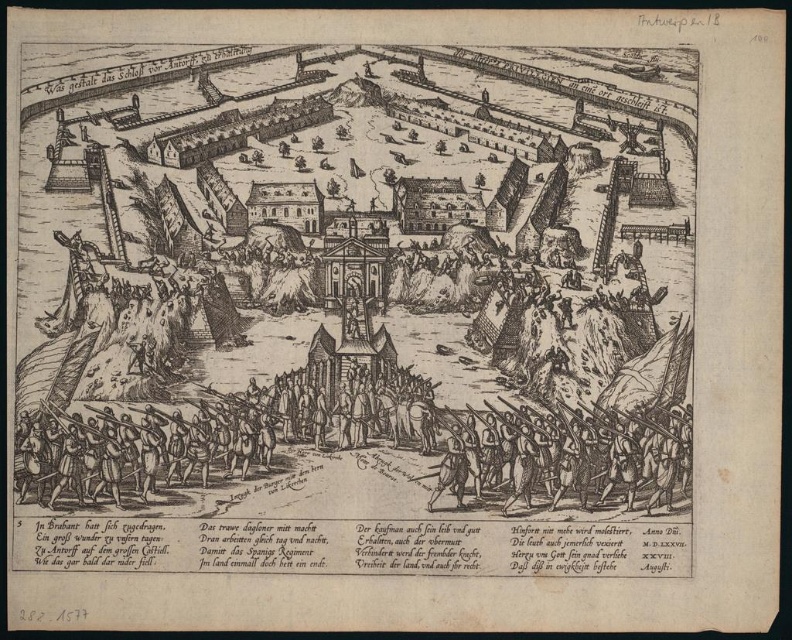
Question: Which point is closer to the camera?

Choices:
 (A) (168, 449)
 (B) (535, 476)
 (C) (309, 376)

Answer: (B)

Question: Which object is positioned farthest from the wooden spears at center?

Choices:
 (A) wooden spears at lower center
 (B) wooden soldiers at center

Answer: (B)

Question: Which point is closer to the camera?

Choices:
 (A) (606, 461)
 (B) (461, 440)
 (C) (566, 420)

Answer: (A)

Question: Is wooden soldiers at center thinner than wooden spears at lower center?

Choices:
 (A) no
 (B) yes

Answer: (A)

Question: Does wooden spears at center have a smaller size compared to wooden spears at lower center?

Choices:
 (A) yes
 (B) no

Answer: (B)

Question: Does wooden soldiers at center have a smaller size compared to wooden spears at lower center?

Choices:
 (A) no
 (B) yes

Answer: (A)